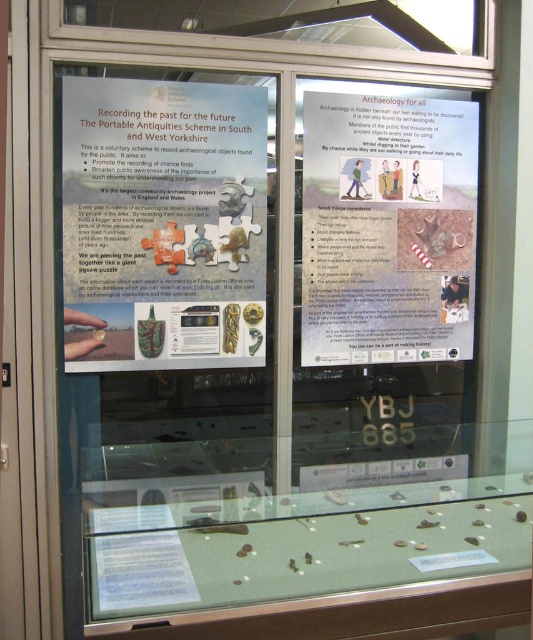
Question: Does matte paper poster at center appear on the right side of matte paper poster at upper right?

Choices:
 (A) no
 (B) yes

Answer: (A)

Question: Among these objects, which one is farthest from the camera?

Choices:
 (A) matte paper poster at center
 (B) matte paper poster at upper right

Answer: (B)

Question: Which object is closer to the camera taking this photo?

Choices:
 (A) matte paper poster at center
 (B) matte paper poster at upper right

Answer: (A)

Question: Can you confirm if matte paper poster at center is wider than matte paper poster at upper right?

Choices:
 (A) yes
 (B) no

Answer: (A)

Question: In this image, where is matte paper poster at center located relative to matte paper poster at upper right?

Choices:
 (A) left
 (B) right

Answer: (A)